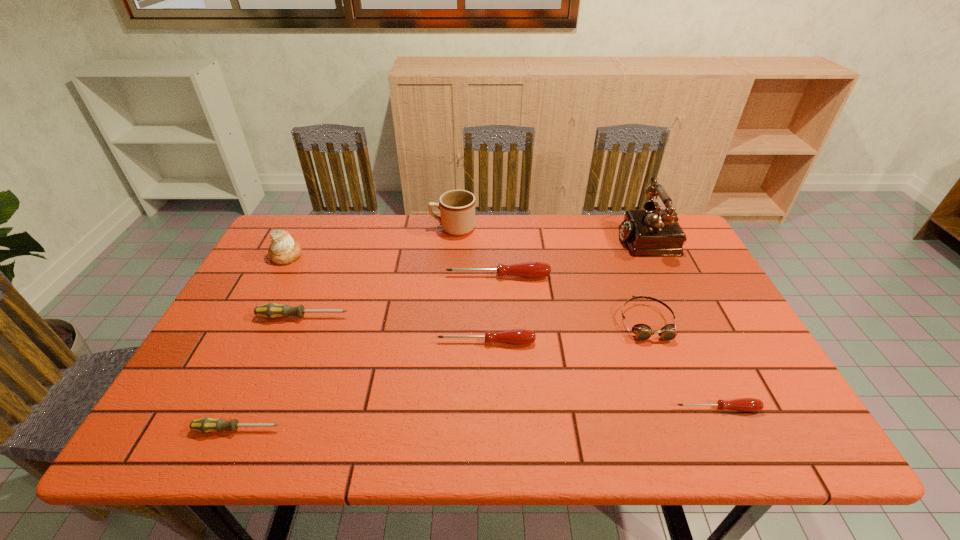
This screenshot has height=540, width=960. In order to click on mug that is at the far edge in this screenshot , I will do `click(457, 207)`.

The width and height of the screenshot is (960, 540). Find the location of `pastry that is at the far edge`. pastry that is at the far edge is located at coordinates (283, 250).

I want to click on pastry present at the left edge, so [x=283, y=250].

You are a GUI agent. You are given a task and a screenshot of the screen. Output one action in this format:
    pyautogui.click(x=<x>, y=<y>)
    Task: Click on the telephone that is at the right edge
    The image size is (960, 540).
    Given the screenshot: What is the action you would take?
    pyautogui.click(x=652, y=232)

Find the location of a particular element. screwdriver that is at the right edge is located at coordinates (744, 404).

Locate an element on the screen. Image resolution: width=960 pixels, height=540 pixels. object located in the far left corner section of the desktop is located at coordinates (283, 250).

The height and width of the screenshot is (540, 960). Find the location of `object that is at the near left corner`. object that is at the near left corner is located at coordinates (208, 424).

This screenshot has width=960, height=540. I want to click on object located at the far right corner, so click(652, 232).

Where is `object present at the near right corner`? This screenshot has height=540, width=960. object present at the near right corner is located at coordinates (744, 404).

Image resolution: width=960 pixels, height=540 pixels. Find the location of `vacant region at the far edge of the desktop`. vacant region at the far edge of the desktop is located at coordinates (569, 238).